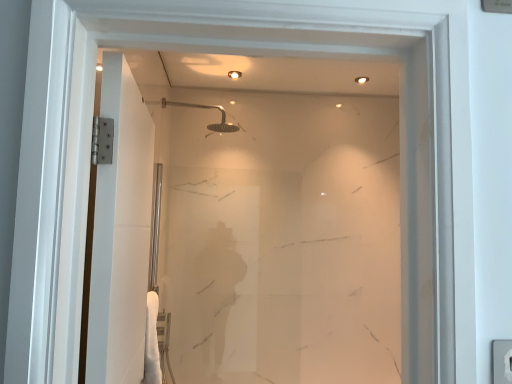
Question: In terms of size, does clear glass screen door at left appear bigger or smaller than matte silver shower head at upper center?

Choices:
 (A) big
 (B) small

Answer: (A)

Question: Is clear glass screen door at left in front of or behind matte silver shower head at upper center in the image?

Choices:
 (A) behind
 (B) front

Answer: (B)

Question: From a real-world perspective, is clear glass screen door at left above or below matte silver shower head at upper center?

Choices:
 (A) below
 (B) above

Answer: (A)

Question: In the image, is matte silver shower head at upper center positioned in front of or behind clear glass screen door at left?

Choices:
 (A) front
 (B) behind

Answer: (B)

Question: From a real-world perspective, is matte silver shower head at upper center above or below clear glass screen door at left?

Choices:
 (A) above
 (B) below

Answer: (A)

Question: Is matte silver shower head at upper center to the left or to the right of clear glass screen door at left in the image?

Choices:
 (A) left
 (B) right

Answer: (B)

Question: Considering the positions of matte silver shower head at upper center and clear glass screen door at left in the image, is matte silver shower head at upper center wider or thinner than clear glass screen door at left?

Choices:
 (A) wide
 (B) thin

Answer: (A)